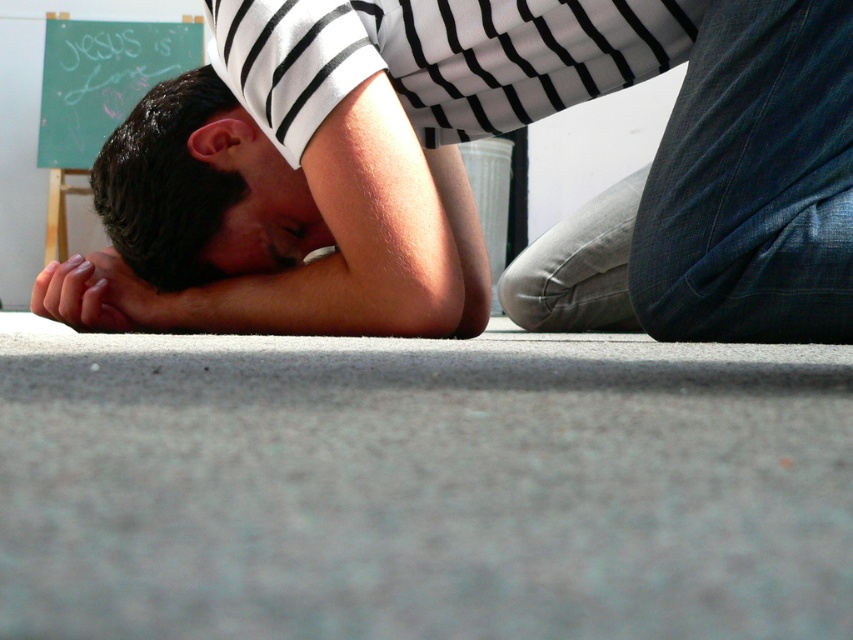
Question: Does matte black shirt at center have a lesser width compared to dark brown hair at center?

Choices:
 (A) yes
 (B) no

Answer: (B)

Question: Which object appears closest to the camera in this image?

Choices:
 (A) dark brown hair at center
 (B) smooth skin hand at lower left
 (C) matte black shirt at center

Answer: (C)

Question: Which of the following is the closest to the observer?

Choices:
 (A) (631, 272)
 (B) (219, 227)
 (C) (68, 307)
 (D) (173, 125)

Answer: (A)

Question: Does matte black shirt at center have a larger size compared to smooth skin face at center?

Choices:
 (A) yes
 (B) no

Answer: (A)

Question: Which of the following is the closest to the observer?

Choices:
 (A) (144, 301)
 (B) (457, 60)

Answer: (B)

Question: From the image, what is the correct spatial relationship of smooth skin face at center in relation to smooth skin hand at lower left?

Choices:
 (A) left
 (B) right

Answer: (B)